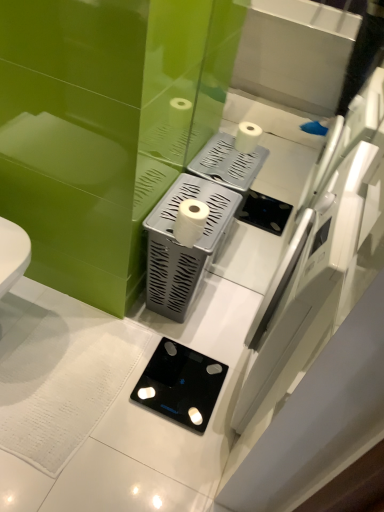
The height and width of the screenshot is (512, 384). What are the coordinates of `silver textured tissue holder at center` in the screenshot? It's located at (183, 246).

Locate an element on the screen. This screenshot has height=512, width=384. white matte toilet paper at center is located at coordinates (190, 222).

Measure the distance from white matte toilet paper at center to black glass scale at lower center.

white matte toilet paper at center is 20.49 inches from black glass scale at lower center.

Based on the photo, is white matte toilet paper at center not within black glass scale at lower center?

Yes, white matte toilet paper at center is not within black glass scale at lower center.

Considering the relative positions of white matte toilet paper at center and black glass scale at lower center in the image provided, is white matte toilet paper at center to the left or to the right of black glass scale at lower center?

Based on their positions, white matte toilet paper at center is located to the right of black glass scale at lower center.

Is the position of white matte toilet paper at center less distant than that of black glass scale at lower center?

Yes, it is.

Does white matte toilet paper at center have a smaller size compared to silver textured tissue holder at center?

Indeed, white matte toilet paper at center has a smaller size compared to silver textured tissue holder at center.

From the image's perspective, who appears lower, white matte toilet paper at center or silver textured tissue holder at center?

silver textured tissue holder at center, from the image's perspective.

Considering the positions of objects white matte toilet paper at center and silver textured tissue holder at center in the image provided, who is more to the right, white matte toilet paper at center or silver textured tissue holder at center?

white matte toilet paper at center.

Considering the relative sizes of white matte toilet paper at center and silver textured tissue holder at center in the image provided, is white matte toilet paper at center taller than silver textured tissue holder at center?

No, white matte toilet paper at center is not taller than silver textured tissue holder at center.

Is silver textured tissue holder at center with white matte toilet paper at center?

silver textured tissue holder at center and white matte toilet paper at center are not in contact.

From the image's perspective, which one is positioned higher, silver textured tissue holder at center or white matte toilet paper at center?

white matte toilet paper at center is shown above in the image.

Can you confirm if silver textured tissue holder at center is taller than black glass scale at lower center?

Correct, silver textured tissue holder at center is much taller as black glass scale at lower center.

Can you confirm if silver textured tissue holder at center is smaller than black glass scale at lower center?

Incorrect, silver textured tissue holder at center is not smaller in size than black glass scale at lower center.

From a real-world perspective, between silver textured tissue holder at center and black glass scale at lower center, who is vertically lower?

black glass scale at lower center is physically lower.

Based on their positions, is silver textured tissue holder at center located to the left or right of black glass scale at lower center?

silver textured tissue holder at center is to the right of black glass scale at lower center.

Locate an element on the screen. Image resolution: width=384 pixels, height=512 pixels. appliance on the right of black glass scale at lower center is located at coordinates (183, 246).

Between black glass scale at lower center and silver textured tissue holder at center, which one appears on the right side from the viewer's perspective?

silver textured tissue holder at center.

From the image's perspective, is black glass scale at lower center beneath silver textured tissue holder at center?

Yes.

Does black glass scale at lower center appear on the left side of white matte toilet paper at center?

Yes.

From the image's perspective, is black glass scale at lower center on top of white matte toilet paper at center?

No, from the image's perspective, black glass scale at lower center is not above white matte toilet paper at center.

Does black glass scale at lower center have a lesser width compared to white matte toilet paper at center?

Incorrect, the width of black glass scale at lower center is not less than that of white matte toilet paper at center.

Consider the image. Measure the distance between black glass scale at lower center and white matte toilet paper at center.

They are 20.49 inches apart.

The height and width of the screenshot is (512, 384). I want to click on toilet paper that is on the right side of black glass scale at lower center, so click(x=190, y=222).

Where is `toilet paper above the silver textured tissue holder at center (from the image's perspective)`? The image size is (384, 512). toilet paper above the silver textured tissue holder at center (from the image's perspective) is located at coordinates (190, 222).

Considering their positions, is silver textured tissue holder at center positioned further to black glass scale at lower center than white matte toilet paper at center?

Among the two, white matte toilet paper at center is located further to black glass scale at lower center.

Based on their spatial positions, is black glass scale at lower center or silver textured tissue holder at center further from white matte toilet paper at center?

black glass scale at lower center lies further to white matte toilet paper at center than the other object.

Considering their positions, is silver textured tissue holder at center positioned further to white matte toilet paper at center than black glass scale at lower center?

black glass scale at lower center is positioned further to the anchor white matte toilet paper at center.

Looking at the image, which one is located closer to silver textured tissue holder at center, black glass scale at lower center or white matte toilet paper at center?

The object closer to silver textured tissue holder at center is white matte toilet paper at center.

When comparing their distances from black glass scale at lower center, does white matte toilet paper at center or silver textured tissue holder at center seem closer?

The object closer to black glass scale at lower center is silver textured tissue holder at center.

Based on their spatial positions, is white matte toilet paper at center or black glass scale at lower center further from silver textured tissue holder at center?

Based on the image, black glass scale at lower center appears to be further to silver textured tissue holder at center.

You are a GUI agent. You are given a task and a screenshot of the screen. Output one action in this format:
    pyautogui.click(x=<x>, y=<y>)
    Task: Click on the appliance between white matte toilet paper at center and black glass scale at lower center in the up-down direction
    
    Given the screenshot: What is the action you would take?
    pyautogui.click(x=183, y=246)